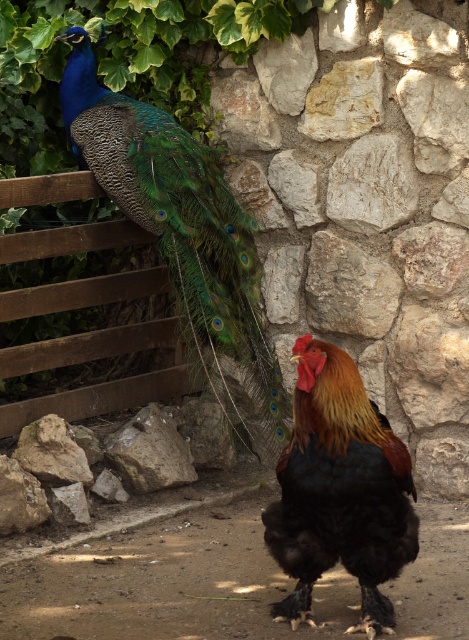
Between shiny blue peacock at upper left and brown rough rock at center, which one has less height?

Standing shorter between the two is brown rough rock at center.

Is shiny blue peacock at upper left taller than brown rough rock at center?

Yes.

This screenshot has height=640, width=469. In order to click on shiny blue peacock at upper left in this screenshot , I will do `click(183, 237)`.

The height and width of the screenshot is (640, 469). Identify the location of shiny blue peacock at upper left. [183, 237].

Is black glossy rooster at center thinner than brown rough rock at center?

No.

Can you confirm if black glossy rooster at center is smaller than brown rough rock at center?

Incorrect, black glossy rooster at center is not smaller in size than brown rough rock at center.

Does point (381, 528) come closer to viewer compared to point (150, 477)?

That is True.

This screenshot has height=640, width=469. In order to click on black glossy rooster at center in this screenshot , I will do `click(340, 490)`.

Which is in front, point (165, 218) or point (281, 500)?

Point (281, 500) is in front.

Can you confirm if shiny blue peacock at upper left is taller than black glossy rooster at center?

Indeed, shiny blue peacock at upper left has a greater height compared to black glossy rooster at center.

Locate an element on the screen. shiny blue peacock at upper left is located at coordinates (183, 237).

At what (x,y) coordinates should I click in order to perform the action: click on shiny blue peacock at upper left. Please return your answer as a coordinate pair (x, y). The width and height of the screenshot is (469, 640). Looking at the image, I should click on (183, 237).